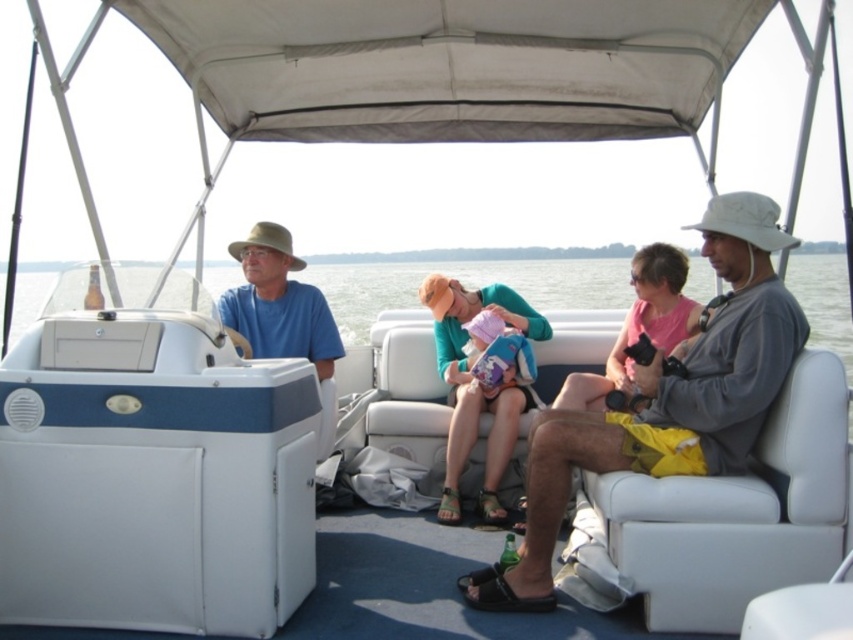
You are a photographer trying to capture a clear shot of the gray fabric hat at center and the pink fabric bag at center. Since you want to focus on the smaller object, which one should you zoom in on?

The pink fabric bag at center is smaller than the gray fabric hat at center, so you should zoom in on the pink fabric bag at center to focus on the smaller object.

You are standing at the origin point of the coordinate system placed at the center of the pontoon boat. You want to hand a life jacket to the person wearing the matte blue shirt at left. In which direction should you move to reach them?

The person wearing the matte blue shirt at left is located at coordinate point [277,301]. Since the coordinate system has its origin at the center of the pontoon boat, moving towards positive x and positive y directions will lead you to their location.

You are a passenger on the pontoon boat and need to locate your pink fabric bag at center. Which direction should you move relative to the gray fabric hat at center to find it?

The gray fabric hat at center is positioned on the left side of the pink fabric bag at center, so you should move to the right of the gray fabric hat at center to find the pink fabric bag at center.